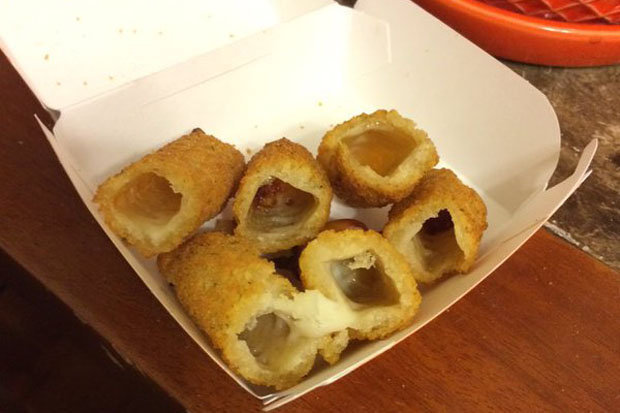
You are a GUI agent. You are given a task and a screenshot of the screen. Output one action in this format:
    pyautogui.click(x=<x>, y=<y>)
    Task: Click on the edge of table
    
    Given the screenshot: What is the action you would take?
    pyautogui.click(x=99, y=330)